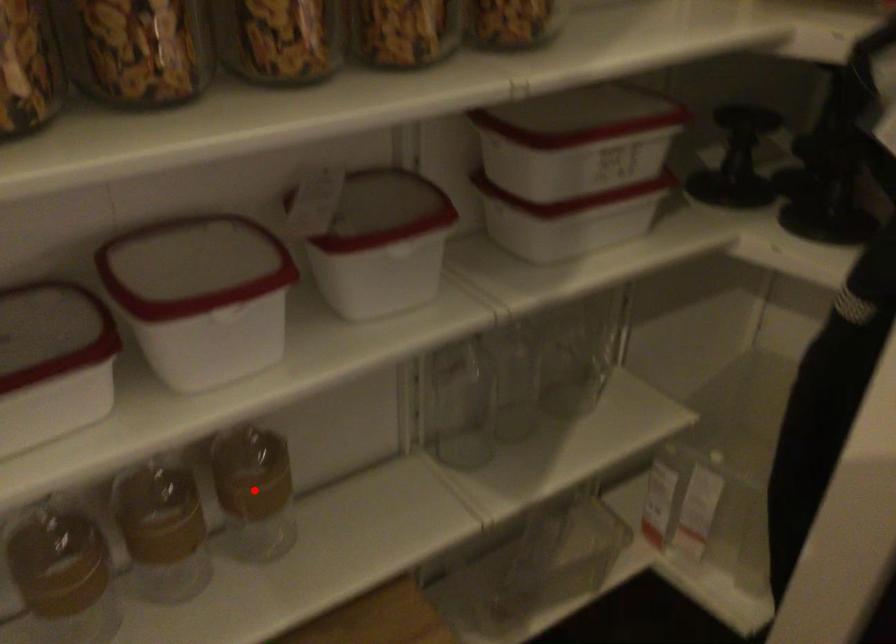
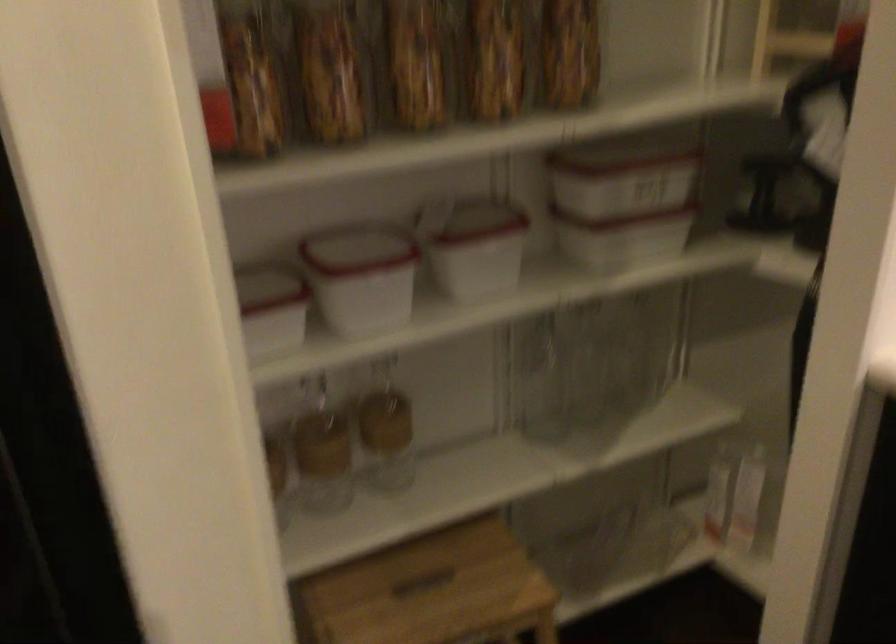
Where in the second image is the point corresponding to the highlighted location from the first image?

(385, 430)